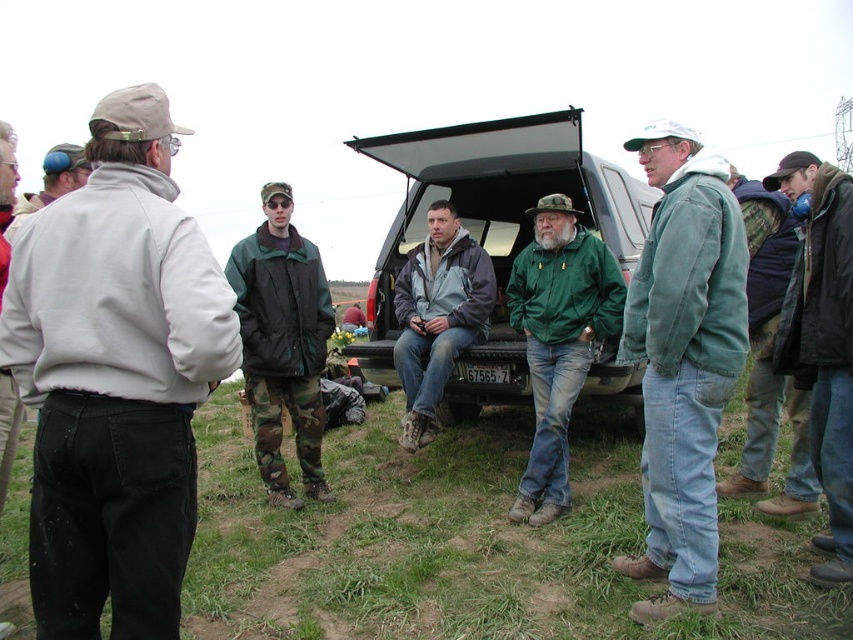
Question: Which object is the closest to the green corduroy jacket at center?

Choices:
 (A) matte black truck at center
 (B) camouflage pants at center
 (C) light gray fleece jacket at left
 (D) green matte jacket at center

Answer: (D)

Question: Among these objects, which one is farthest from the camera?

Choices:
 (A) gray-green jacket at center
 (B) matte black truck at center
 (C) camouflage pants at center
 (D) light gray fleece jacket at left

Answer: (A)

Question: Is the position of matte black truck at center less distant than that of gray-green jacket at center?

Choices:
 (A) no
 (B) yes

Answer: (B)

Question: Is light gray fleece jacket at left above camouflage pants at center?

Choices:
 (A) no
 (B) yes

Answer: (A)

Question: Which object is farther from the camera taking this photo?

Choices:
 (A) green corduroy jacket at center
 (B) camouflage pants at center
 (C) gray-green jacket at center
 (D) light gray fleece jacket at left

Answer: (C)

Question: Is the position of matte black truck at center more distant than that of camouflage pants at center?

Choices:
 (A) yes
 (B) no

Answer: (A)